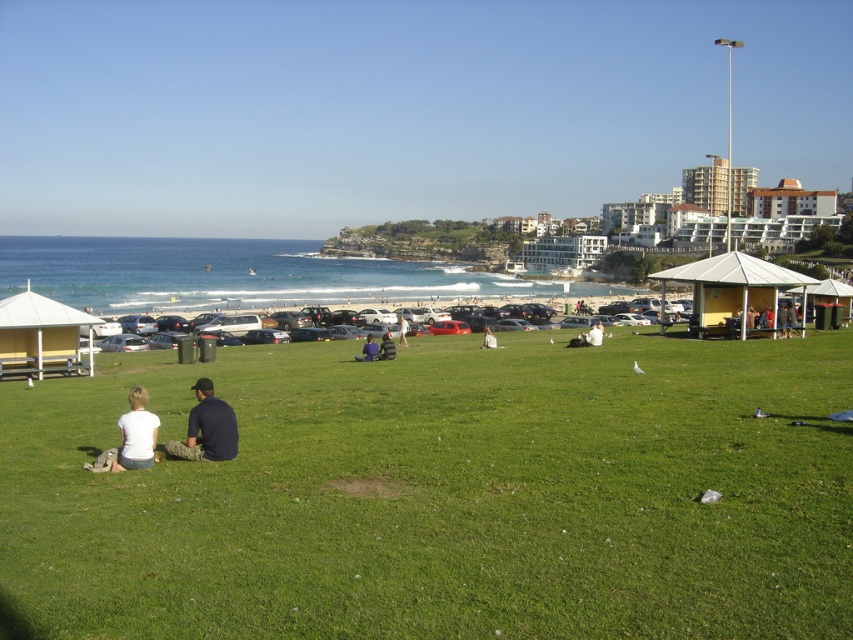
Which is more to the right, white matte shirt at lower left or white fabric bag at center?

Positioned to the right is white fabric bag at center.

What do you see at coordinates (136, 433) in the screenshot? The width and height of the screenshot is (853, 640). I see `white matte shirt at lower left` at bounding box center [136, 433].

The height and width of the screenshot is (640, 853). I want to click on white matte shirt at lower left, so click(x=136, y=433).

Consider the image. Is white fabric person at lower center positioned behind light blue denim shorts at center?

No, it is not.

Is white fabric person at lower center smaller than light blue denim shorts at center?

Incorrect, white fabric person at lower center is not smaller in size than light blue denim shorts at center.

Who is more forward, (x=587, y=333) or (x=398, y=330)?

Point (x=587, y=333)

The image size is (853, 640). I want to click on white fabric person at lower center, so click(595, 333).

You are a GUI agent. You are given a task and a screenshot of the screen. Output one action in this format:
    pyautogui.click(x=<x>, y=<y>)
    Task: Click on the light blue denim shorts at center
    The width and height of the screenshot is (853, 640).
    Given the screenshot: What is the action you would take?
    coord(402,330)

In the scene shown: Between light blue denim shorts at center and white fabric bag at center, which one appears on the left side from the viewer's perspective?

light blue denim shorts at center is more to the left.

This screenshot has width=853, height=640. I want to click on light blue denim shorts at center, so click(x=402, y=330).